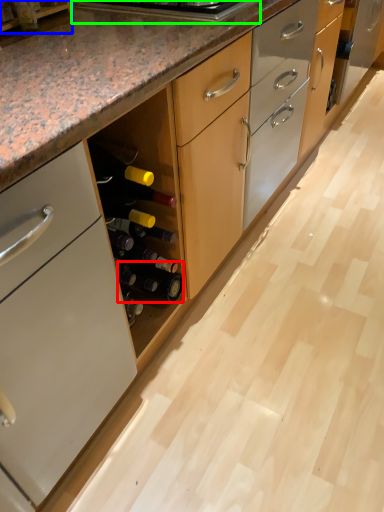
Question: Which object is the farthest from beer bottle (highlighted by a red box)? Choose among these: shelf (highlighted by a blue box) or appliance (highlighted by a green box).

Choices:
 (A) shelf
 (B) appliance

Answer: (A)